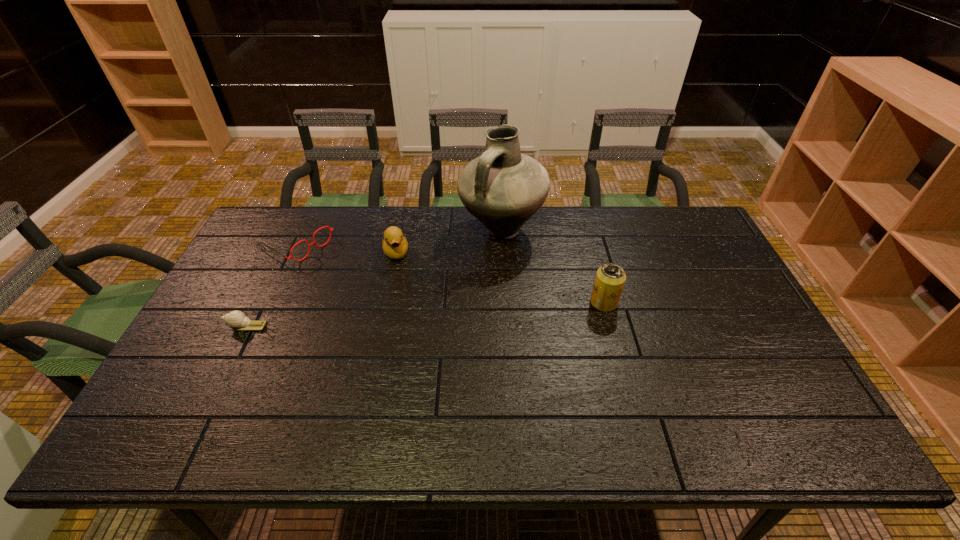
You are a GUI agent. You are given a task and a screenshot of the screen. Output one action in this format:
    pyautogui.click(x=<x>, y=<y>)
    Task: Click on the free space on the desktop that is between the nearest object and the fourth farthest object and is positioned on the face of the third tallest object
    Image resolution: width=960 pixels, height=540 pixels.
    Given the screenshot: What is the action you would take?
    pyautogui.click(x=409, y=315)

What are the coordinates of `vacant spot on the desktop that is between the nearest object and the second nearest object and is positioned on the front-facing side of the spectacles` in the screenshot? It's located at (424, 314).

Find the location of `free spot on the desktop that is between the nearest object and the fourth shortest object and is positioned on the handle side of the pitcher`. free spot on the desktop that is between the nearest object and the fourth shortest object and is positioned on the handle side of the pitcher is located at coordinates pos(471,311).